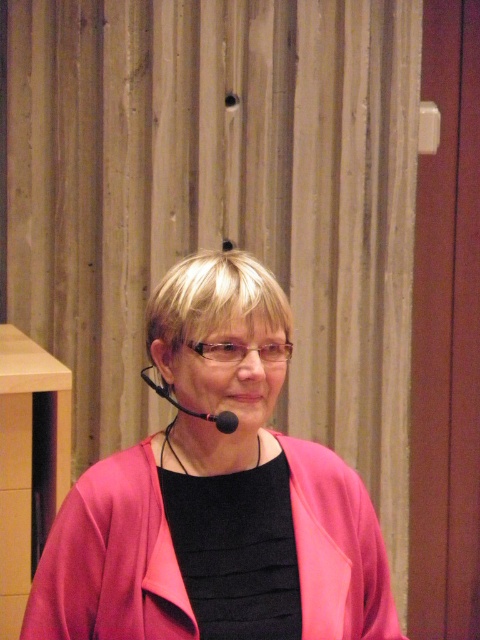
You are organizing a small event and need to place a 1.2 meter wide decorative panel between the pink matte jacket at center and the wooden stool at left. Can the space between them accommodate the panel?

The pink matte jacket at center occupies less space than the wooden stool at left, so the space between them may not be wide enough to fit a 1.2 meter panel. Check the actual distance before placing it.

You are organizing a small event and need to know if the pink matte jacket at center can be moved to another location without disturbing the wooden stool at left. Is this possible?

The pink matte jacket at center is positioned over the wooden stool at left, so moving the jacket would require lifting it off the stool, which would disturb the stool.

You are a photographer setting up for a presentation. You have two points marked on your camera screen at coordinates point (120, 552) and point (57, 500). Which point is closer to you?

Point (120, 552) is closer to the viewer than point (57, 500).